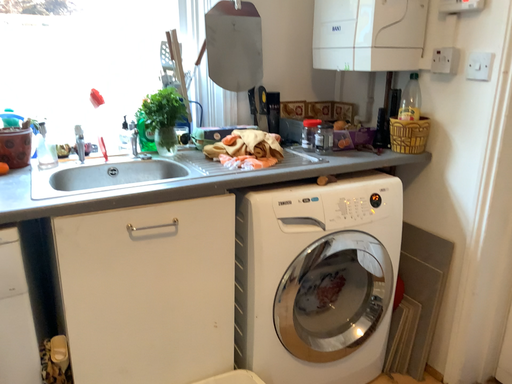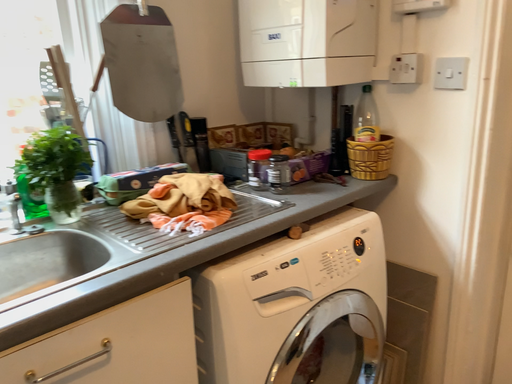
Question: How did the camera likely rotate when shooting the video?

Choices:
 (A) rotated left
 (B) rotated right

Answer: (B)